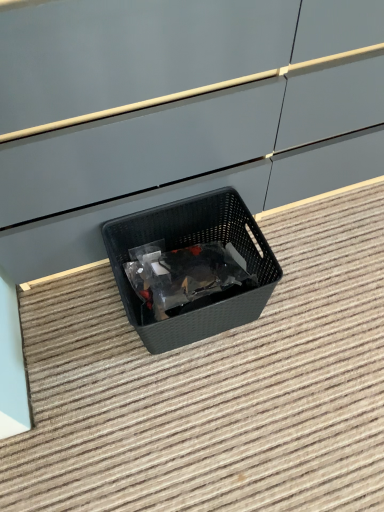
Question: Considering the relative positions of black plastic basket at center and black plastic basket at center in the image provided, is black plastic basket at center to the left of black plastic basket at center from the viewer's perspective?

Choices:
 (A) yes
 (B) no

Answer: (B)

Question: Does black plastic basket at center appear on the right side of black plastic basket at center?

Choices:
 (A) yes
 (B) no

Answer: (A)

Question: Can we say black plastic basket at center lies outside black plastic basket at center?

Choices:
 (A) no
 (B) yes

Answer: (B)

Question: Does black plastic basket at center have a lesser height compared to black plastic basket at center?

Choices:
 (A) no
 (B) yes

Answer: (B)

Question: Can you confirm if black plastic basket at center is bigger than black plastic basket at center?

Choices:
 (A) yes
 (B) no

Answer: (A)

Question: Considering the relative sizes of black plastic basket at center and black plastic basket at center in the image provided, is black plastic basket at center wider than black plastic basket at center?

Choices:
 (A) yes
 (B) no

Answer: (A)

Question: Is black plastic basket at center completely or partially outside of black plastic basket at center?

Choices:
 (A) no
 (B) yes

Answer: (B)

Question: Is the position of black plastic basket at center more distant than that of black plastic basket at center?

Choices:
 (A) no
 (B) yes

Answer: (B)

Question: From a real-world perspective, is black plastic basket at center beneath black plastic basket at center?

Choices:
 (A) no
 (B) yes

Answer: (A)

Question: Considering the relative positions of black plastic basket at center and black plastic basket at center in the image provided, is black plastic basket at center to the left of black plastic basket at center from the viewer's perspective?

Choices:
 (A) yes
 (B) no

Answer: (A)

Question: Considering the relative sizes of black plastic basket at center and black plastic basket at center in the image provided, is black plastic basket at center thinner than black plastic basket at center?

Choices:
 (A) no
 (B) yes

Answer: (B)

Question: Considering the relative sizes of black plastic basket at center and black plastic basket at center in the image provided, is black plastic basket at center shorter than black plastic basket at center?

Choices:
 (A) yes
 (B) no

Answer: (B)

Question: Looking at the image, does black plastic basket at center seem bigger or smaller compared to black plastic basket at center?

Choices:
 (A) small
 (B) big

Answer: (A)